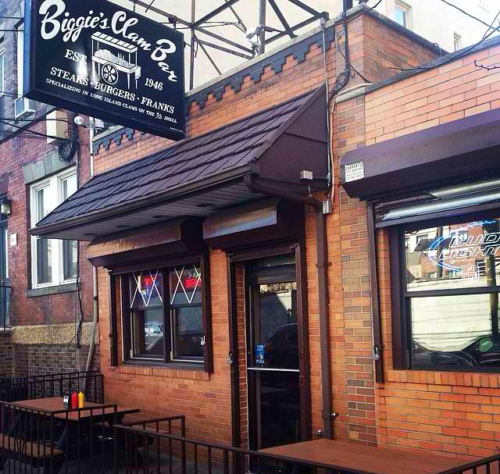
Where is `door`? door is located at coordinates (280, 355).